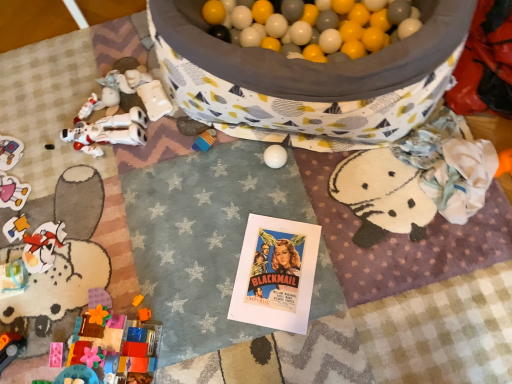
Question: Considering the relative positions of orange plastic car at lower left, the 3th toy from the back, and brick-like plastic blocks at lower left, which is counted as the 2th toy, starting from the bottom, in the image provided, is orange plastic car at lower left, the 3th toy from the back, behind brick-like plastic blocks at lower left, which is counted as the 2th toy, starting from the bottom,?

Choices:
 (A) yes
 (B) no

Answer: (A)

Question: Considering the relative positions of orange plastic car at lower left, positioned as the fourth toy in top-to-bottom order, and brick-like plastic blocks at lower left, arranged as the first toy when viewed from the front, in the image provided, is orange plastic car at lower left, positioned as the fourth toy in top-to-bottom order, in front of brick-like plastic blocks at lower left, arranged as the first toy when viewed from the front,?

Choices:
 (A) no
 (B) yes

Answer: (A)

Question: Can you confirm if orange plastic car at lower left, the 3th toy from the back, is smaller than brick-like plastic blocks at lower left, placed as the third toy when sorted from top to bottom?

Choices:
 (A) yes
 (B) no

Answer: (A)

Question: From a real-world perspective, is orange plastic car at lower left, the 2th toy viewed from the front, positioned under brick-like plastic blocks at lower left, arranged as the first toy when viewed from the front, based on gravity?

Choices:
 (A) yes
 (B) no

Answer: (A)

Question: Does orange plastic car at lower left, the 3th toy from the back, have a lesser height compared to brick-like plastic blocks at lower left, which is counted as the 2th toy, starting from the bottom?

Choices:
 (A) no
 (B) yes

Answer: (B)

Question: From a real-world perspective, does orange plastic car at lower left, which ranks as the 1th toy in bottom-to-top order, stand above brick-like plastic blocks at lower left, which is counted as the 2th toy, starting from the bottom?

Choices:
 (A) yes
 (B) no

Answer: (B)

Question: Considering the relative sizes of white matte robot at left, the third toy positioned from the front, and plastic toy car at lower left, the 1th toy positioned from the back, in the image provided, is white matte robot at left, the third toy positioned from the front, wider than plastic toy car at lower left, the 1th toy positioned from the back,?

Choices:
 (A) yes
 (B) no

Answer: (A)

Question: Does white matte robot at left, acting as the second toy starting from the back, touch plastic toy car at lower left, the 1th toy positioned from the back?

Choices:
 (A) yes
 (B) no

Answer: (B)

Question: Does white matte robot at left, the third toy positioned from the front, have a smaller size compared to plastic toy car at lower left, which is counted as the 2th toy, starting from the top?

Choices:
 (A) yes
 (B) no

Answer: (B)

Question: Is plastic toy car at lower left, which is counted as the 2th toy, starting from the top, completely or partially inside white matte robot at left, the third toy positioned from the front?

Choices:
 (A) no
 (B) yes

Answer: (A)

Question: Is white matte robot at left, acting as the second toy starting from the back, positioned behind plastic toy car at lower left, placed as the fourth toy when sorted from front to back?

Choices:
 (A) no
 (B) yes

Answer: (A)

Question: Is white matte robot at left, acting as the second toy starting from the back, at the right side of plastic toy car at lower left, which is counted as the 2th toy, starting from the top?

Choices:
 (A) no
 (B) yes

Answer: (B)

Question: Does orange plastic car at lower left, the 3th toy from the back, have a larger size compared to white matte robot at left, acting as the second toy starting from the back?

Choices:
 (A) yes
 (B) no

Answer: (B)